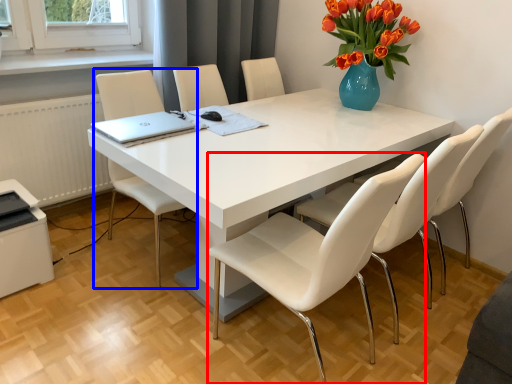
Question: Which point is further to the camera, chair (highlighted by a red box) or chair (highlighted by a blue box)?

Choices:
 (A) chair
 (B) chair

Answer: (B)